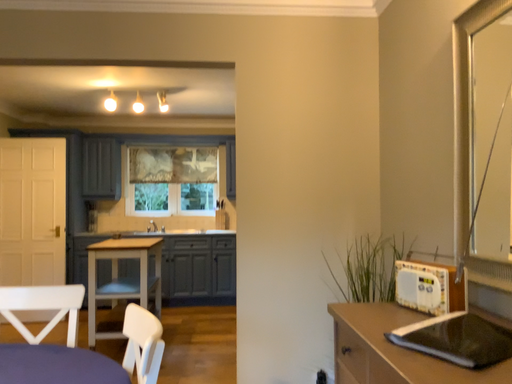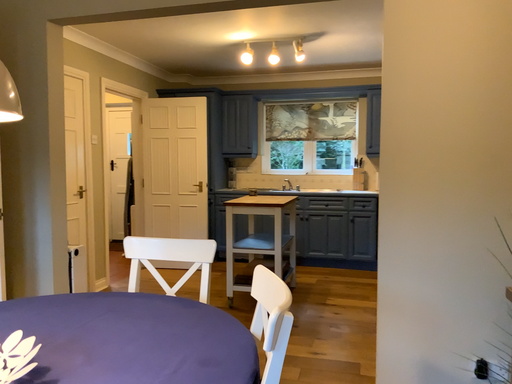
Question: How did the camera likely rotate when shooting the video?

Choices:
 (A) rotated right
 (B) rotated left

Answer: (B)